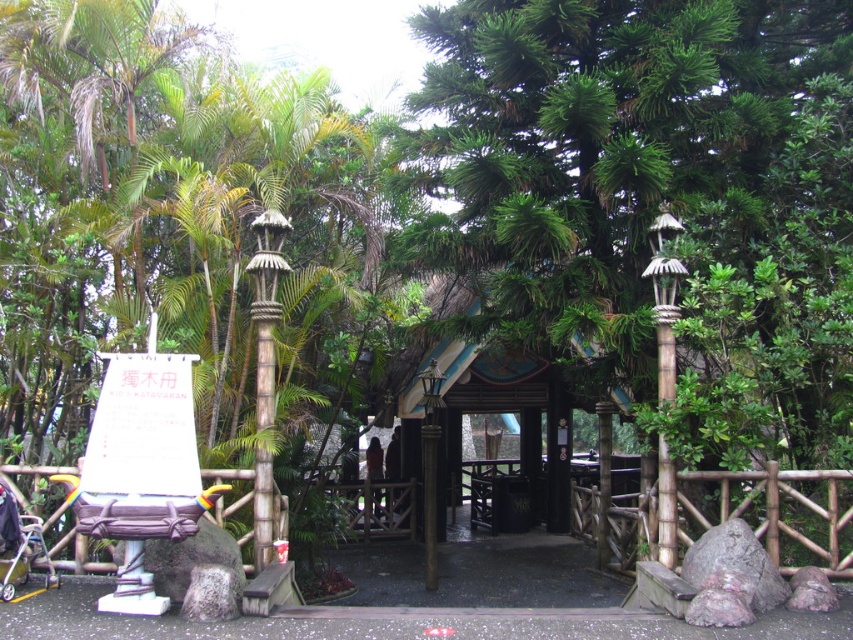
Question: Can you confirm if matte purple chair at center is positioned below bamboo textured lamp post at right?

Choices:
 (A) yes
 (B) no

Answer: (A)

Question: Which object is positioned closest to the bamboo textured lamp post at right?

Choices:
 (A) bamboo textured pole at center
 (B) metallic polished lamp post at center
 (C) metallic silver baby carriage at lower left
 (D) matte purple chair at center

Answer: (A)

Question: Where is matte purple chair at center located in relation to bamboo textured lamp post at right in the image?

Choices:
 (A) above
 (B) below

Answer: (B)

Question: Is matte purple chair at center above metallic silver baby carriage at lower left?

Choices:
 (A) yes
 (B) no

Answer: (A)

Question: Among these points, which one is nearest to the camera?

Choices:
 (A) (39, 528)
 (B) (440, 404)
 (C) (268, 264)
 (D) (660, 228)

Answer: (A)

Question: Among these objects, which one is nearest to the camera?

Choices:
 (A) matte purple chair at center
 (B) metallic silver baby carriage at lower left
 (C) bamboo textured lamp post at right
 (D) metallic polished lamp post at center

Answer: (A)